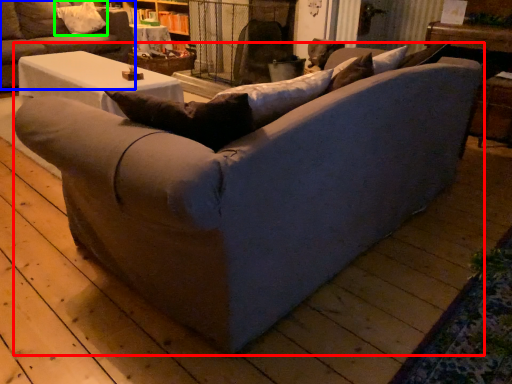
Question: Considering the real-world distances, which object is farthest from studio couch (highlighted by a red box)? studio couch (highlighted by a blue box) or pillow (highlighted by a green box)?

Choices:
 (A) studio couch
 (B) pillow

Answer: (B)